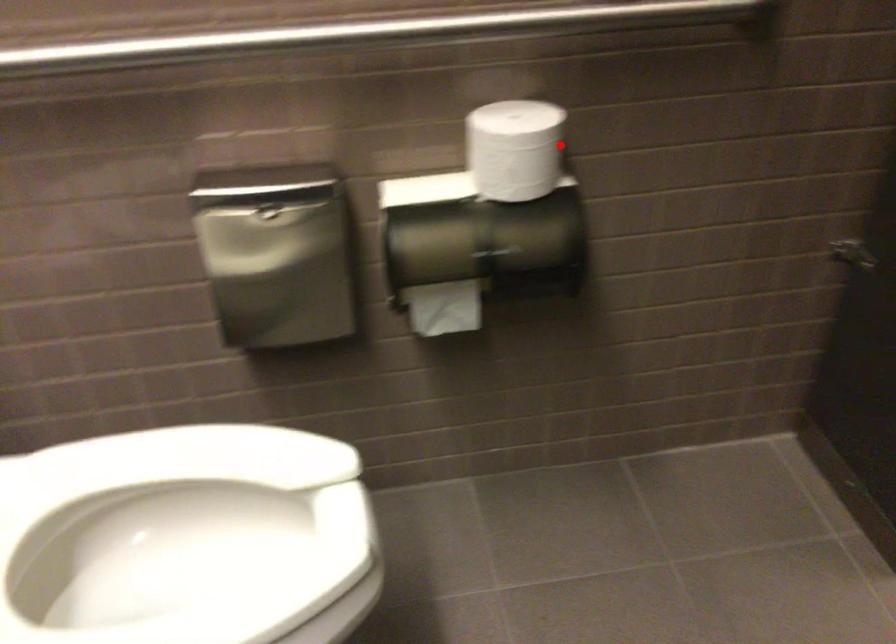
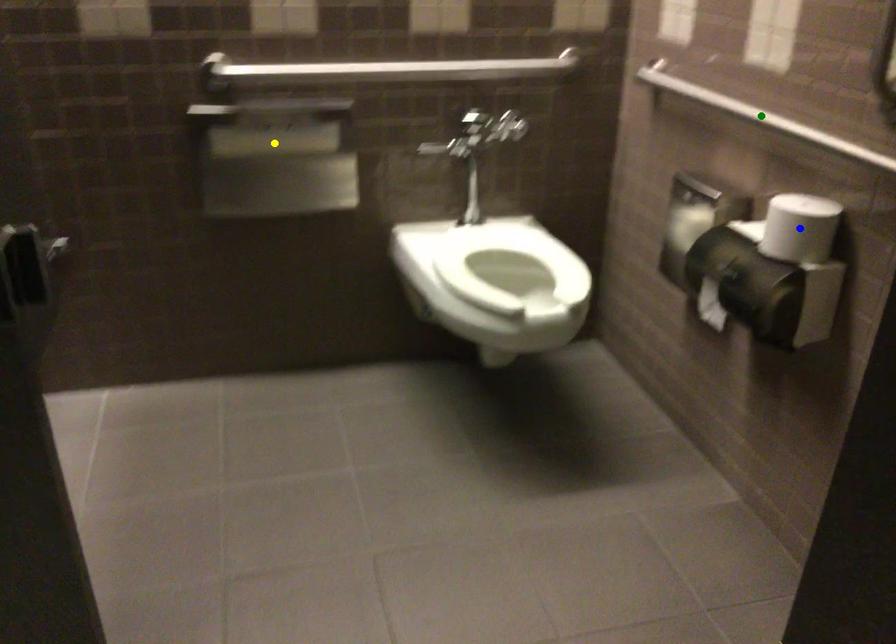
Question: I am providing you with two images of the same scene from different viewpoints. A red point is marked on the first image. You are given multiple points on the second image. Which mark in image 2 goes with the point in image 1?

Choices:
 (A) yellow point
 (B) green point
 (C) blue point

Answer: (C)